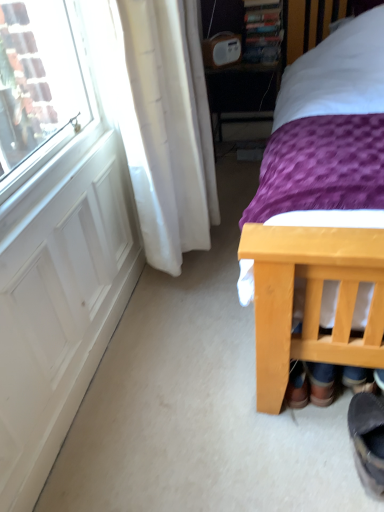
Question: Is dark grey suede boot at lower right at the back of wooden table at center?

Choices:
 (A) yes
 (B) no

Answer: (B)

Question: From a real-world perspective, is wooden table at center under dark grey suede boot at lower right?

Choices:
 (A) yes
 (B) no

Answer: (B)

Question: Considering the relative sizes of wooden table at center and dark grey suede boot at lower right in the image provided, is wooden table at center shorter than dark grey suede boot at lower right?

Choices:
 (A) no
 (B) yes

Answer: (A)

Question: Is wooden table at center facing towards dark grey suede boot at lower right?

Choices:
 (A) yes
 (B) no

Answer: (A)

Question: Can you confirm if wooden table at center is smaller than dark grey suede boot at lower right?

Choices:
 (A) no
 (B) yes

Answer: (A)

Question: Is point (3, 278) positioned closer to the camera than point (258, 74)?

Choices:
 (A) farther
 (B) closer

Answer: (B)

Question: Considering their positions, is white matte screen door at left located in front of or behind wooden table at center?

Choices:
 (A) front
 (B) behind

Answer: (A)

Question: Do you think white matte screen door at left is within wooden table at center, or outside of it?

Choices:
 (A) outside
 (B) inside

Answer: (A)

Question: From the image's perspective, is white matte screen door at left positioned above or below wooden table at center?

Choices:
 (A) below
 (B) above

Answer: (A)

Question: Is purple fabric bed at right taller or shorter than white matte screen door at left?

Choices:
 (A) tall
 (B) short

Answer: (A)

Question: From the image's perspective, is purple fabric bed at right positioned above or below white matte screen door at left?

Choices:
 (A) above
 (B) below

Answer: (A)

Question: Does point (357, 259) appear closer or farther from the camera than point (125, 296)?

Choices:
 (A) farther
 (B) closer

Answer: (B)

Question: From a real-world perspective, relative to white matte screen door at left, is purple fabric bed at right vertically above or below?

Choices:
 (A) above
 (B) below

Answer: (A)

Question: Relative to white matte screen door at left, is dark grey suede boot at lower right in front or behind?

Choices:
 (A) behind
 (B) front

Answer: (B)

Question: Which is correct: dark grey suede boot at lower right is inside white matte screen door at left, or outside of it?

Choices:
 (A) outside
 (B) inside

Answer: (A)